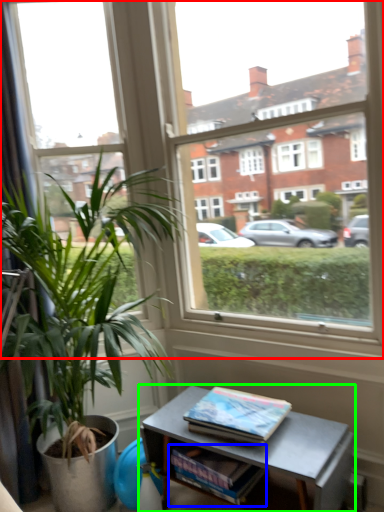
Question: Which object is positioned farthest from window (highlighted by a red box)? Select from magazine (highlighted by a blue box) and table (highlighted by a green box).

Choices:
 (A) magazine
 (B) table

Answer: (A)